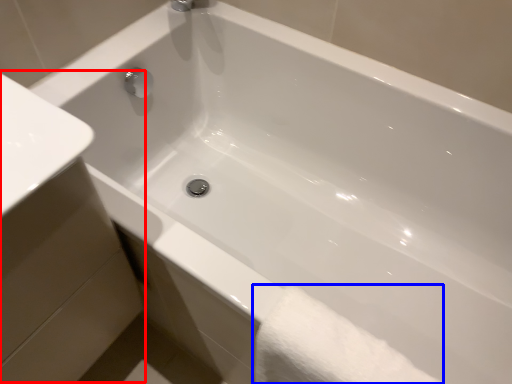
Question: Which object appears farthest to the camera in this image, sink (highlighted by a red box) or bath towel (highlighted by a blue box)?

Choices:
 (A) sink
 (B) bath towel

Answer: (B)